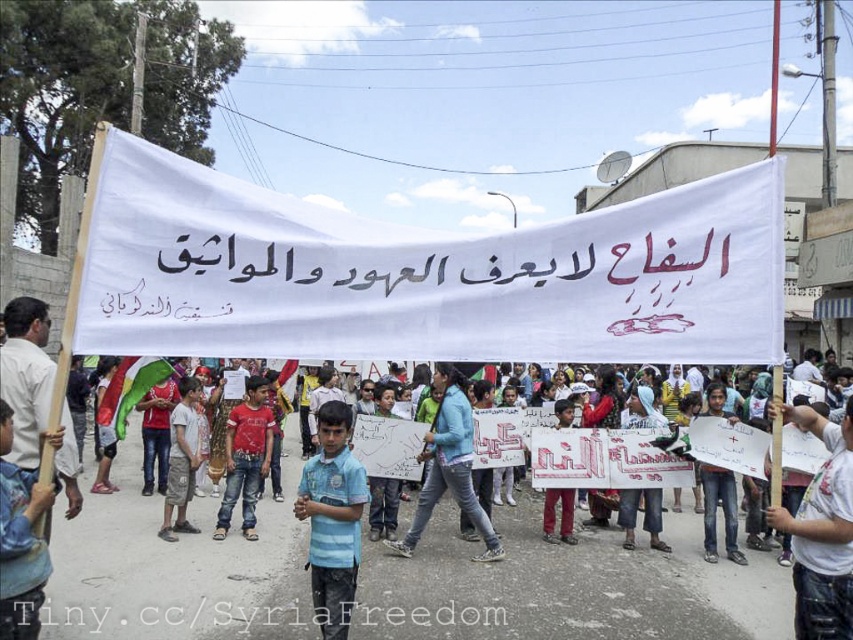
You are a photographer trying to capture the protest scene. You notice two points in the image at coordinates point (21, 499) and point (131, 385). Which point is closer to the camera?

Point (21, 499) is in front of point (131, 385), so it is closer to the camera.

You are a photographer standing at the center of the protest scene. You notice a point marked at coordinates [20,541]. What object is this point located on?

The point at coordinates [20,541] is located on the blue fabric at center.

You are a photographer at the protest. You want to capture a photo that includes both the blue striped shirt at center and the green fabric flag at center. Based on their positions, which object should be placed lower in the photo?

The blue striped shirt at center should be placed lower in the photo because it is located below the green fabric flag at center.